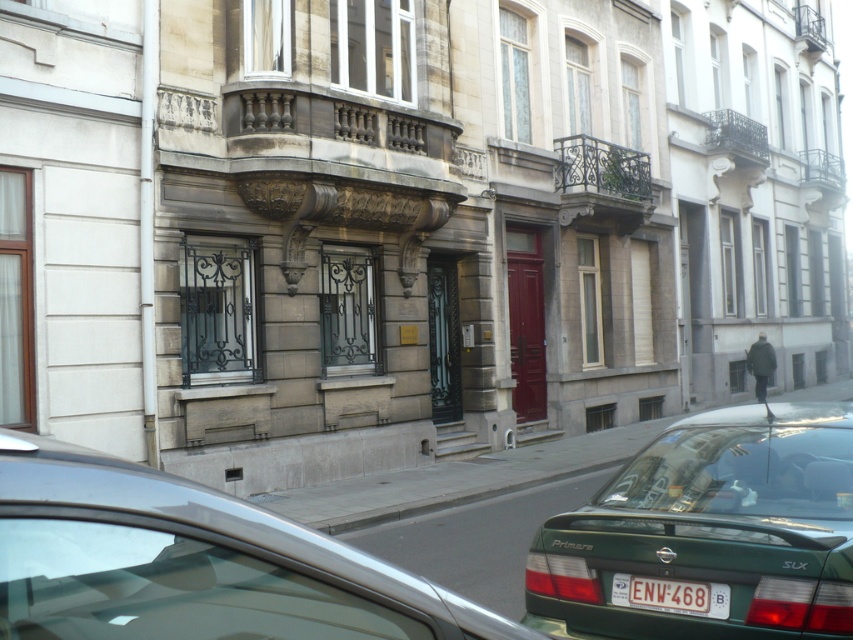
Which of these two, metallic silver car at lower left or white plastic license plate at center, stands shorter?

white plastic license plate at center is shorter.

Is point (223, 586) in front of point (697, 604)?

Yes, point (223, 586) is in front of point (697, 604).

Is point (100, 513) behind point (718, 595)?

No, it is in front of (718, 595).

Where is `metallic silver car at lower left`? The height and width of the screenshot is (640, 853). metallic silver car at lower left is located at coordinates (190, 563).

Describe the element at coordinates (709, 534) in the screenshot. This screenshot has width=853, height=640. I see `green matte car at lower right` at that location.

What do you see at coordinates (709, 534) in the screenshot? This screenshot has height=640, width=853. I see `green matte car at lower right` at bounding box center [709, 534].

Find the location of `green matte car at lower right`. green matte car at lower right is located at coordinates (709, 534).

Who is more distant from viewer, (173,576) or (720,518)?

Positioned behind is point (720,518).

Is point (19, 492) positioned in front of point (836, 621)?

Yes, it is in front of point (836, 621).

Find the location of a particular element. metallic silver car at lower left is located at coordinates (190, 563).